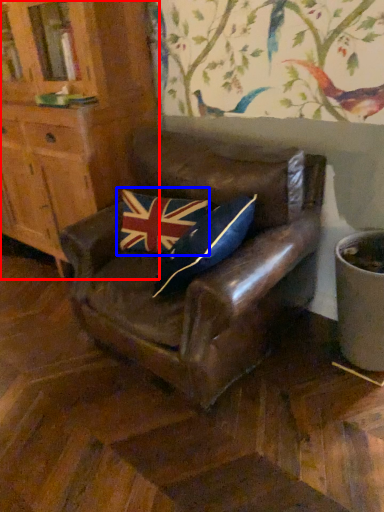
Question: Which point is further to the camera, cabinetry (highlighted by a red box) or flag (highlighted by a blue box)?

Choices:
 (A) cabinetry
 (B) flag

Answer: (B)